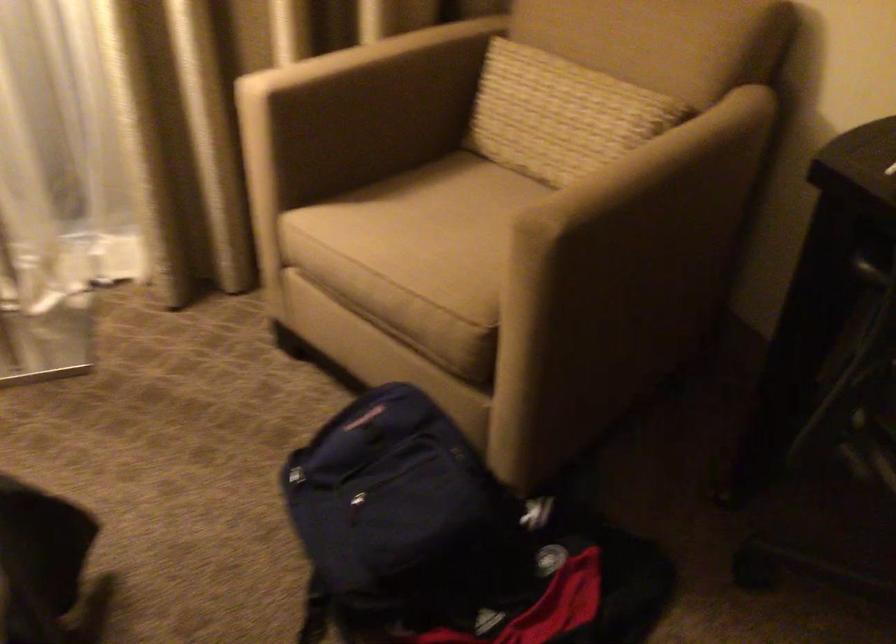
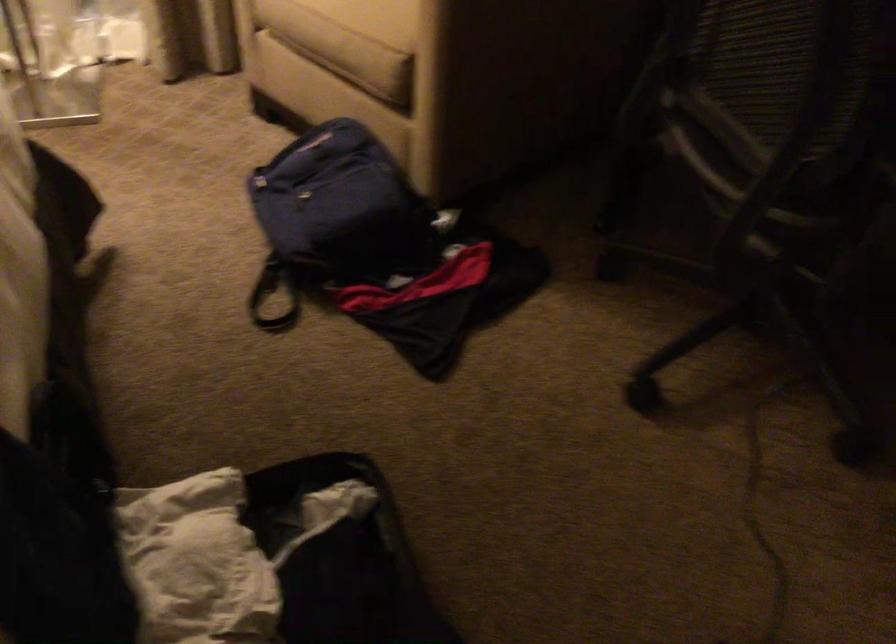
Question: Based on the continuous images, in which direction is the camera rotating? Reply with the corresponding letter.

Choices:
 (A) Left
 (B) Right
 (C) Up
 (D) Down

Answer: (D)